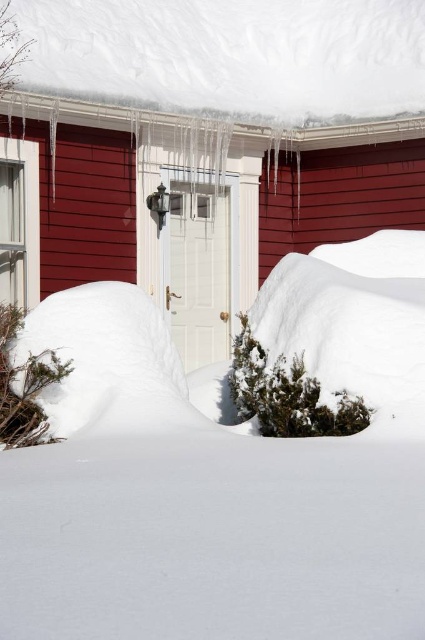
Is white fluffy snow at center thinner than white snow-covered roof at upper center?

Yes.

The image size is (425, 640). I want to click on white fluffy snow at center, so click(x=223, y=468).